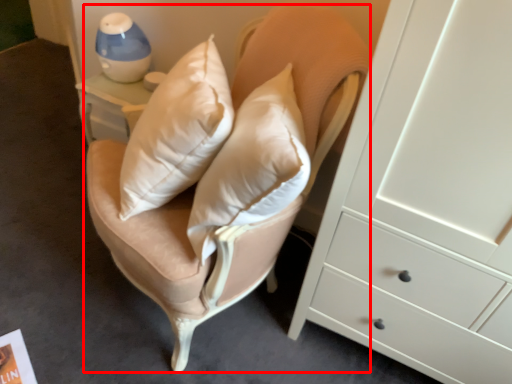
Question: In this image, where is swivel chair (annotated by the red box) located relative to table lamp?

Choices:
 (A) right
 (B) left

Answer: (A)